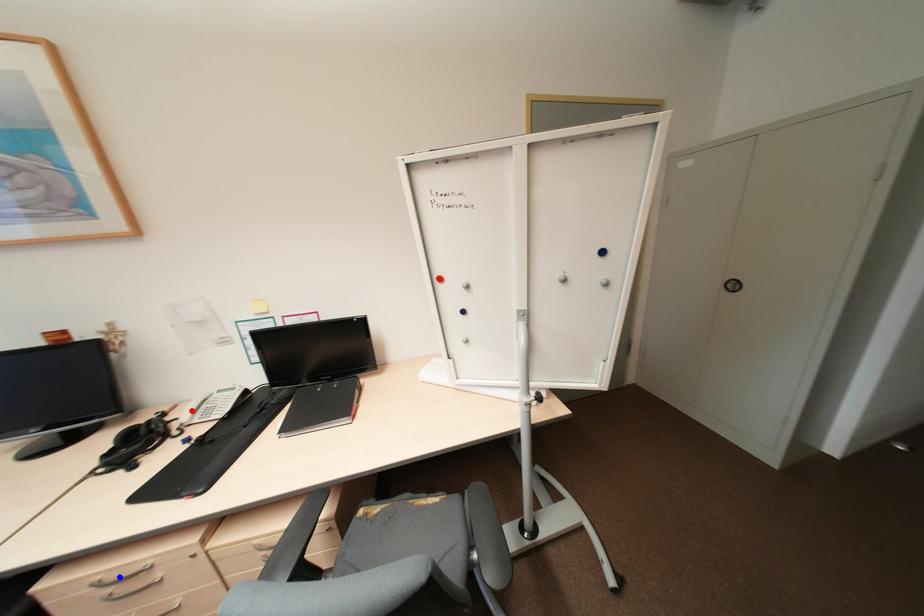
Question: Two points are marked on the image. Which point is closer to the camera?

Choices:
 (A) Blue point is closer.
 (B) Red point is closer.

Answer: (A)